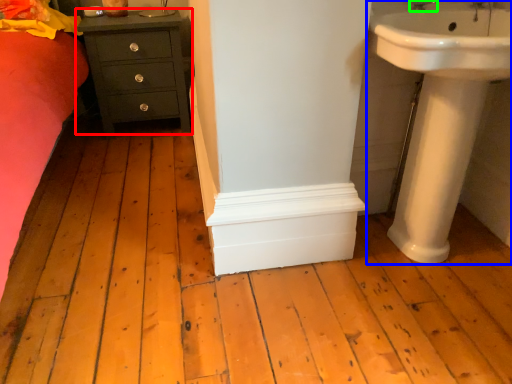
Question: Considering the real-world distances, which object is closest to chest of drawers (highlighted by a red box)? sink (highlighted by a blue box) or tap (highlighted by a green box).

Choices:
 (A) sink
 (B) tap

Answer: (A)